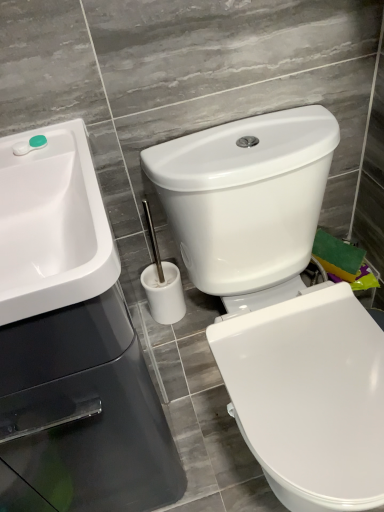
Question: In the image, is white glossy toilet at center positioned in front of or behind white glossy sink at upper left?

Choices:
 (A) front
 (B) behind

Answer: (A)

Question: From a real-world perspective, relative to white glossy sink at upper left, is white glossy toilet at center vertically above or below?

Choices:
 (A) below
 (B) above

Answer: (A)

Question: Which object is the farthest from the green plastic container at upper left?

Choices:
 (A) white glossy toilet at center
 (B) white glossy sink at upper left

Answer: (A)

Question: Estimate the real-world distances between objects in this image. Which object is closer to the white glossy toilet at center?

Choices:
 (A) white glossy sink at upper left
 (B) green plastic container at upper left

Answer: (A)